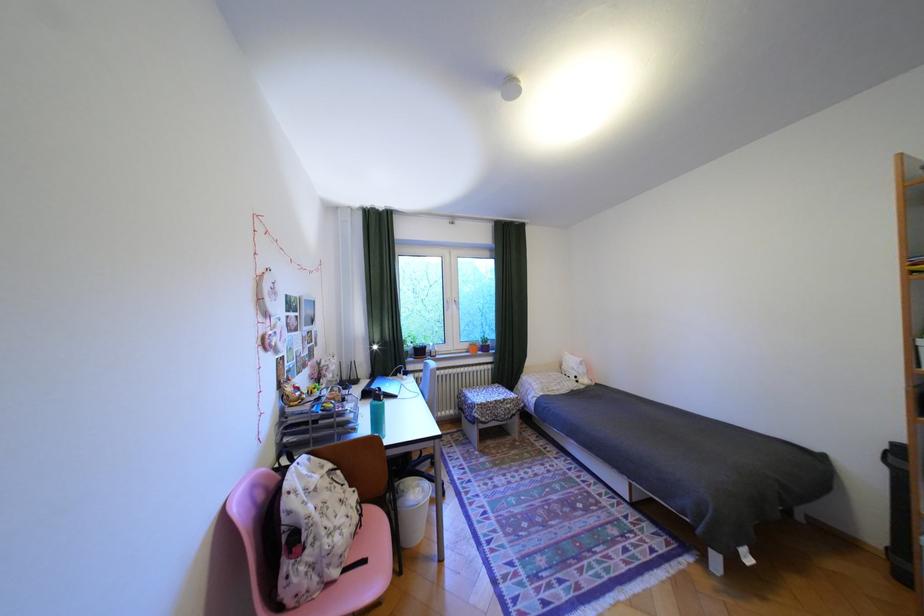
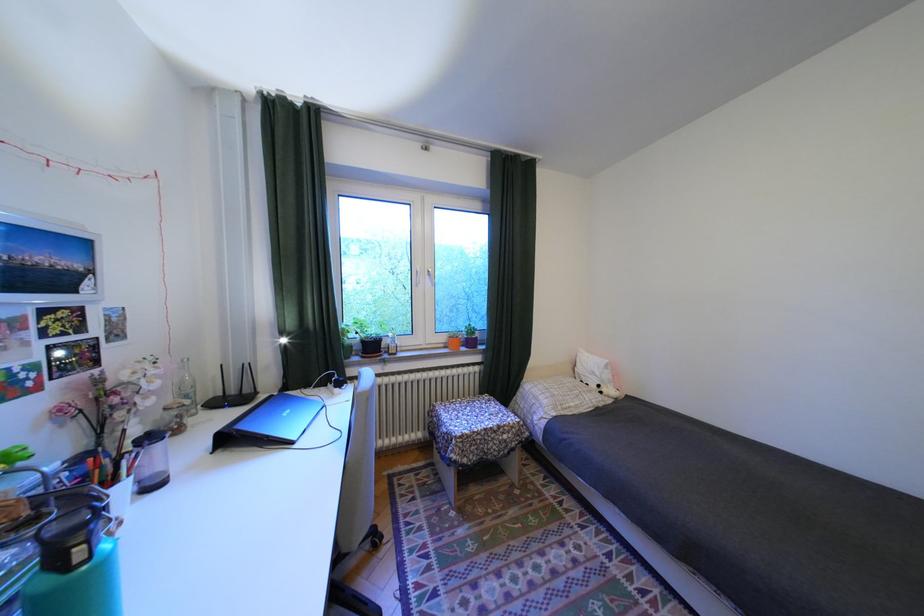
Question: Which direction would the cameraman need to move to produce the second image? Reply with the corresponding letter.

Choices:
 (A) Left
 (B) Right
 (C) Forward
 (D) Backward

Answer: (C)